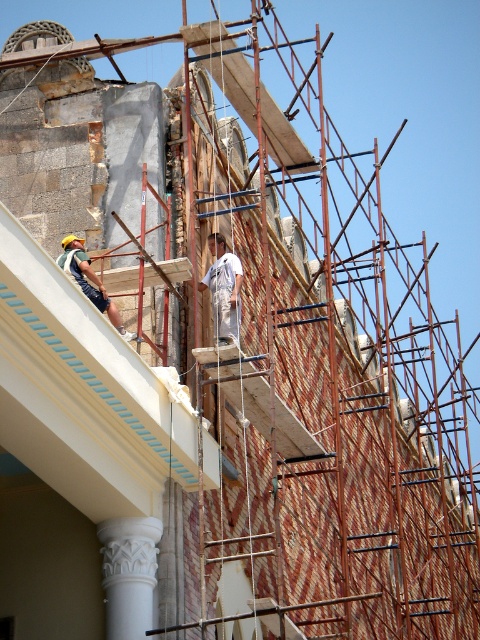
Can you confirm if white carved column at lower left is positioned above white cotton shirt at center?

Incorrect, white carved column at lower left is not positioned above white cotton shirt at center.

Does white carved column at lower left come behind white cotton shirt at center?

No.

Measure the distance between point (132,550) and camera.

The distance of point (132,550) from camera is 50.77 meters.

The height and width of the screenshot is (640, 480). Identify the location of white carved column at lower left. (129, 573).

Is white cotton shirt at center above green fabric construction worker at left?

No, white cotton shirt at center is not above green fabric construction worker at left.

Does white cotton shirt at center appear on the right side of green fabric construction worker at left?

Indeed, white cotton shirt at center is positioned on the right side of green fabric construction worker at left.

Locate an element on the screen. Image resolution: width=480 pixels, height=640 pixels. white cotton shirt at center is located at coordinates (224, 289).

What do you see at coordinates (129, 573) in the screenshot? I see `white carved column at lower left` at bounding box center [129, 573].

Who is more distant from viewer, (108, 616) or (61, 264)?

The point (61, 264) is behind.

This screenshot has height=640, width=480. In order to click on white carved column at lower left in this screenshot , I will do `click(129, 573)`.